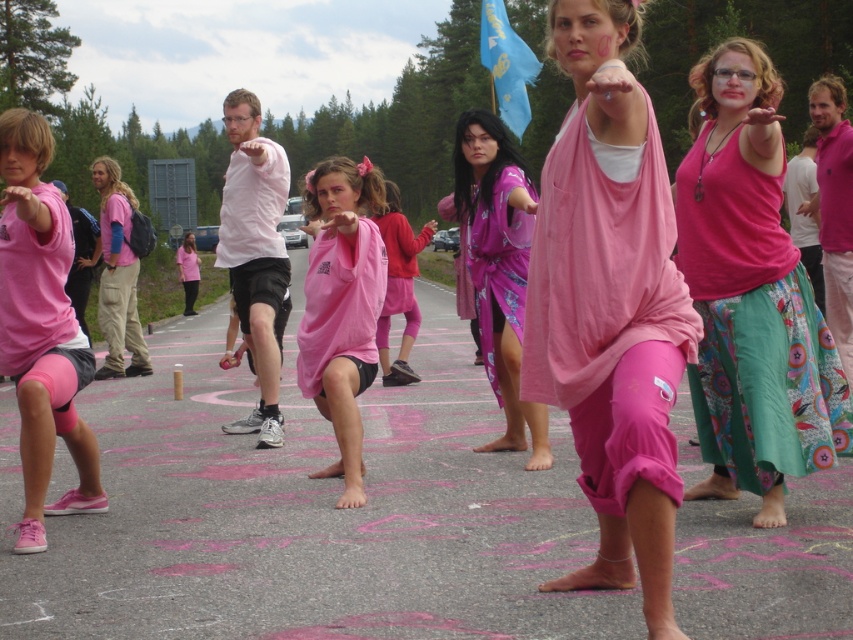
Question: Which of the following is the closest to the observer?

Choices:
 (A) (503, 435)
 (B) (367, 173)
 (C) (415, 253)

Answer: (B)

Question: Which point appears farthest from the camera in this image?

Choices:
 (A) (379, 342)
 (B) (352, 436)
 (C) (815, 358)
 (D) (93, 355)

Answer: (A)

Question: Which of the following is the closest to the observer?

Choices:
 (A) pink fabric at center
 (B) pink fabric dress at center
 (C) pink fabric robe at center

Answer: (A)

Question: Where is pink fabric at center located in relation to pink matte shorts at left in the image?

Choices:
 (A) below
 (B) above

Answer: (A)

Question: Where is pink fabric at center located in relation to pink matte shorts at left in the image?

Choices:
 (A) above
 (B) below

Answer: (B)

Question: Is pink fabric skirt at center thinner than pink matte shorts at left?

Choices:
 (A) no
 (B) yes

Answer: (A)